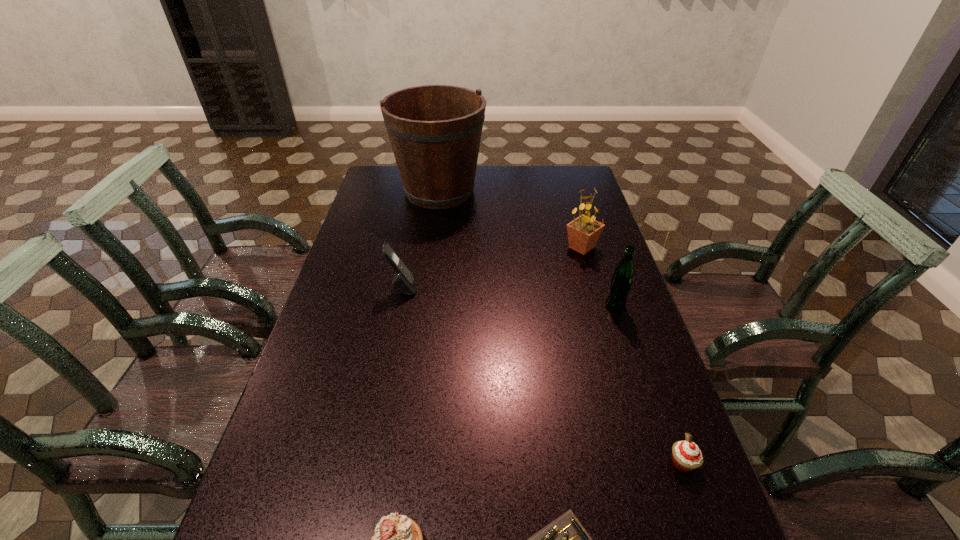
The image size is (960, 540). In order to click on free space that satisfies the following two spatial constraints: 1. at the front of the sunflower with flowers visible; 2. on the right side of the fifth farthest object in this screenshot , I will do `click(643, 462)`.

The image size is (960, 540). What are the coordinates of `free space in the image that satisfies the following two spatial constraints: 1. at the front of the sunflower with flowers visible; 2. on the right side of the beer bottle` in the screenshot? It's located at (598, 306).

This screenshot has width=960, height=540. What are the coordinates of `vacant space that satisfies the following two spatial constraints: 1. on the front-facing side of the cellular telephone; 2. on the back side of the shorter cupcake` in the screenshot? It's located at (370, 462).

Locate an element on the screen. blank space that satisfies the following two spatial constraints: 1. on the back side of the fourth farthest object; 2. at the front of the sunflower with flowers visible is located at coordinates (596, 247).

The image size is (960, 540). I want to click on free space that satisfies the following two spatial constraints: 1. at the front of the sunflower with flowers visible; 2. on the back side of the second shortest object, so coord(643,462).